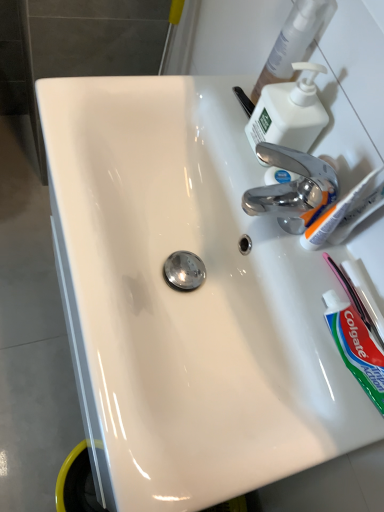
Identify the location of free location in front of green matte toothpaste at lower right. click(x=300, y=425).